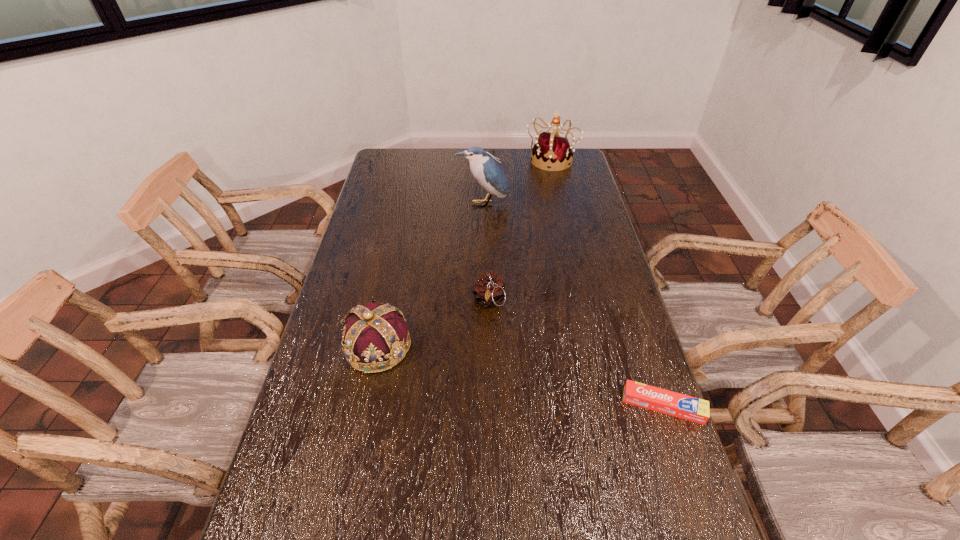
Find the location of a particular element. This screenshot has width=960, height=540. crown is located at coordinates (376, 337).

Find the location of a particular element. This screenshot has width=960, height=540. the third tallest object is located at coordinates (376, 337).

Locate an element on the screen. the nearest object is located at coordinates (686, 407).

You are a GUI agent. You are given a task and a screenshot of the screen. Output one action in this format:
    pyautogui.click(x=<x>, y=<y>)
    Task: Click on the toothpaste
    
    Given the screenshot: What is the action you would take?
    pyautogui.click(x=686, y=407)

I want to click on the third farthest object, so click(x=489, y=291).

Locate an element on the screen. the fourth tallest object is located at coordinates (489, 291).

Locate an element on the screen. The width and height of the screenshot is (960, 540). tiara is located at coordinates (552, 150).

Locate an element on the screen. The width and height of the screenshot is (960, 540). the second farthest object is located at coordinates (486, 170).

I want to click on vacant space located 0.080m on the back of the second nearest object, so point(387,302).

Locate an element on the screen. blank area located on the left of the nearest object is located at coordinates (530, 406).